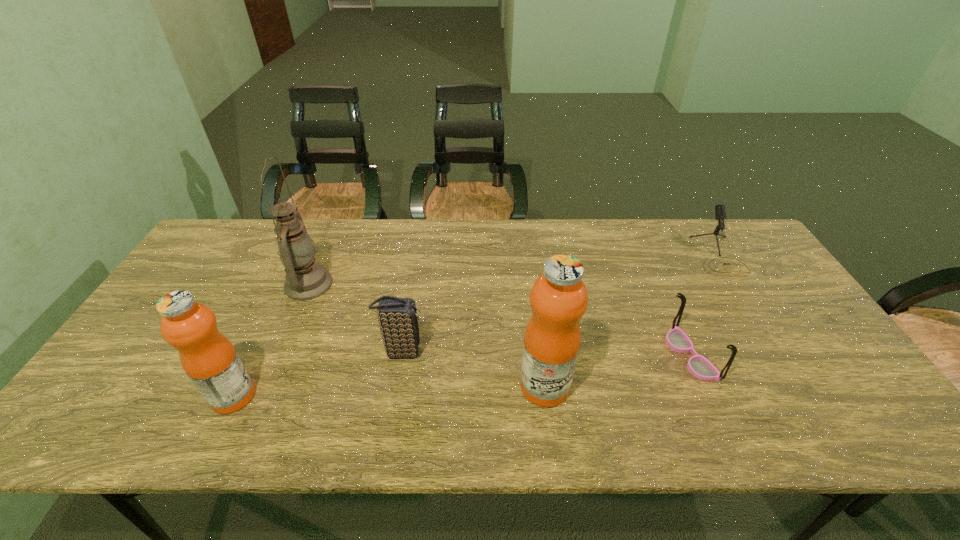
At what (x,y) coordinates should I click in order to perform the action: click on vacant place for an extra fruit juice on the right. Please return your answer as a coordinate pair (x, y). This screenshot has width=960, height=540. Looking at the image, I should click on (845, 377).